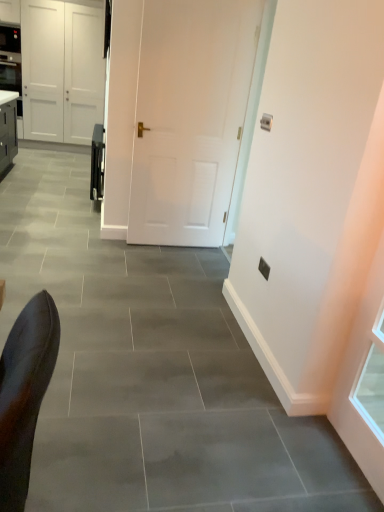
Question: Can you confirm if white matte door at center, which is counted as the first door, starting from the left, is thinner than white matte door at center, the 1th door positioned from the front?

Choices:
 (A) yes
 (B) no

Answer: (B)

Question: Is white matte door at center, which is counted as the first door, starting from the left, further to the viewer compared to white matte door at center, placed as the second door when sorted from back to front?

Choices:
 (A) yes
 (B) no

Answer: (A)

Question: Is white matte door at center, the 1th door positioned from the front, at the back of white matte door at center, which ranks as the first door in top-to-bottom order?

Choices:
 (A) no
 (B) yes

Answer: (A)

Question: Can you confirm if white matte door at center, positioned as the 2th door in right-to-left order, is wider than white matte door at center, which ranks as the 1th door in bottom-to-top order?

Choices:
 (A) no
 (B) yes

Answer: (B)

Question: Is white matte door at center, the 2th door in the left-to-right sequence, located within white matte door at center, the 2th door in the front-to-back sequence?

Choices:
 (A) yes
 (B) no

Answer: (B)

Question: Considering the positions of point (44, 28) and point (183, 70), is point (44, 28) closer or farther from the camera than point (183, 70)?

Choices:
 (A) farther
 (B) closer

Answer: (A)

Question: From a real-world perspective, is white matte door at center, which is counted as the first door, starting from the left, physically located above or below white matte door at center, placed as the second door when sorted from back to front?

Choices:
 (A) above
 (B) below

Answer: (A)

Question: Relative to white matte door at center, the 1th door positioned from the front, is white matte door at center, the 1th door in the back-to-front sequence, in front or behind?

Choices:
 (A) behind
 (B) front

Answer: (A)

Question: From the image's perspective, is white matte door at center, positioned as the 2th door in right-to-left order, located above or below white matte door at center, placed as the second door when sorted from back to front?

Choices:
 (A) below
 (B) above

Answer: (B)

Question: From a real-world perspective, is white matte door at center, the second door in the bottom-to-top sequence, positioned above or below satin black oven at center?

Choices:
 (A) above
 (B) below

Answer: (A)

Question: Is point (46, 117) closer or farther from the camera than point (96, 150)?

Choices:
 (A) farther
 (B) closer

Answer: (A)

Question: In terms of size, does white matte door at center, which ranks as the first door in top-to-bottom order, appear bigger or smaller than satin black oven at center?

Choices:
 (A) small
 (B) big

Answer: (B)

Question: Considering the positions of white matte door at center, positioned as the 2th door in right-to-left order, and satin black oven at center in the image, is white matte door at center, positioned as the 2th door in right-to-left order, wider or thinner than satin black oven at center?

Choices:
 (A) thin
 (B) wide

Answer: (B)

Question: Is white matte door at center, positioned as the 1th door in right-to-left order, in front of or behind white matte door at center, the second door in the bottom-to-top sequence, in the image?

Choices:
 (A) front
 (B) behind

Answer: (A)

Question: From the image's perspective, relative to white matte door at center, which is counted as the first door, starting from the left, is white matte door at center, the second door viewed from the top, above or below?

Choices:
 (A) below
 (B) above

Answer: (A)